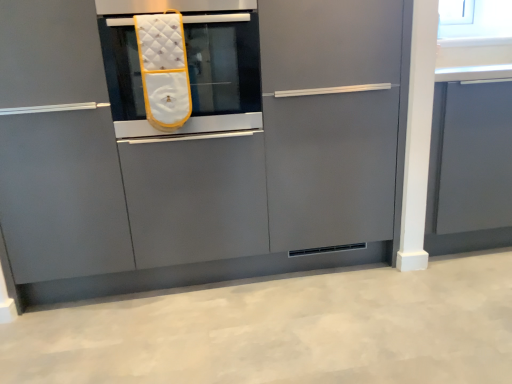
Describe the element at coordinates (195, 144) in the screenshot. I see `matte gray cabinet at center, the first cabinetry from the left` at that location.

What do you see at coordinates (223, 63) in the screenshot? I see `white quilted oven mitt at center` at bounding box center [223, 63].

Locate an element on the screen. The width and height of the screenshot is (512, 384). matte gray cabinet at center, which is the second cabinetry in right-to-left order is located at coordinates (195, 144).

From a real-world perspective, is matte gray cabinet at center, the first cabinetry from the left, positioned under matte gray cabinet at right, the 2th cabinetry positioned from the left, based on gravity?

Incorrect, from a real-world perspective, matte gray cabinet at center, the first cabinetry from the left, is higher than matte gray cabinet at right, the 2th cabinetry positioned from the left.

In the scene shown: In terms of width, does matte gray cabinet at center, which is the second cabinetry in right-to-left order, look wider or thinner when compared to matte gray cabinet at right, marked as the first cabinetry in a right-to-left arrangement?

Considering their sizes, matte gray cabinet at center, which is the second cabinetry in right-to-left order, looks broader than matte gray cabinet at right, marked as the first cabinetry in a right-to-left arrangement.

Is matte gray cabinet at center, which is the second cabinetry in right-to-left order, not close to matte gray cabinet at right, marked as the first cabinetry in a right-to-left arrangement?

matte gray cabinet at center, which is the second cabinetry in right-to-left order, is actually quite close to matte gray cabinet at right, marked as the first cabinetry in a right-to-left arrangement.

Who is smaller, white quilted oven mitt at center or matte gray cabinet at right, the 2th cabinetry positioned from the left?

Smaller between the two is white quilted oven mitt at center.

Consider the image. Are white quilted oven mitt at center and matte gray cabinet at right, the 2th cabinetry positioned from the left, making contact?

There is a gap between white quilted oven mitt at center and matte gray cabinet at right, the 2th cabinetry positioned from the left.

Looking at this image, based on their positions, is white quilted oven mitt at center located to the left or right of matte gray cabinet at right, marked as the first cabinetry in a right-to-left arrangement?

Clearly, white quilted oven mitt at center is on the left of matte gray cabinet at right, marked as the first cabinetry in a right-to-left arrangement, in the image.

This screenshot has width=512, height=384. What are the coordinates of `the 2nd cabinetry to the right of the white quilted oven mitt at center, starting your count from the anchor` in the screenshot? It's located at (470, 168).

How distant is white quilted oven mitt at center from matte gray cabinet at center, which is the second cabinetry in right-to-left order?

8.73 inches.

Is white quilted oven mitt at center directly adjacent to matte gray cabinet at center, the first cabinetry from the left?

No, white quilted oven mitt at center is not in contact with matte gray cabinet at center, the first cabinetry from the left.

Based on the photo, from the image's perspective, who appears lower, white quilted oven mitt at center or matte gray cabinet at center, which is the second cabinetry in right-to-left order?

From the image's view, matte gray cabinet at center, which is the second cabinetry in right-to-left order, is below.

Considering the positions of point (206, 46) and point (203, 235), is point (206, 46) closer or farther from the camera than point (203, 235)?

Clearly, point (206, 46) is closer to the camera than point (203, 235).

Considering the sizes of objects matte gray cabinet at right, marked as the first cabinetry in a right-to-left arrangement, and matte gray cabinet at center, which is the second cabinetry in right-to-left order, in the image provided, who is shorter, matte gray cabinet at right, marked as the first cabinetry in a right-to-left arrangement, or matte gray cabinet at center, which is the second cabinetry in right-to-left order,?

Standing shorter between the two is matte gray cabinet at right, marked as the first cabinetry in a right-to-left arrangement.

Measure the distance from matte gray cabinet at right, the 2th cabinetry positioned from the left, to matte gray cabinet at center, which is the second cabinetry in right-to-left order.

They are 74.49 centimeters apart.

Based on their sizes in the image, would you say matte gray cabinet at right, the 2th cabinetry positioned from the left, is bigger or smaller than matte gray cabinet at center, which is the second cabinetry in right-to-left order?

Considering their sizes, matte gray cabinet at right, the 2th cabinetry positioned from the left, takes up less space than matte gray cabinet at center, which is the second cabinetry in right-to-left order.

Is matte gray cabinet at center, which is the second cabinetry in right-to-left order, at the back of matte gray cabinet at right, the 2th cabinetry positioned from the left?

No, matte gray cabinet at center, which is the second cabinetry in right-to-left order, is not at the back of matte gray cabinet at right, the 2th cabinetry positioned from the left.

Is matte gray cabinet at right, marked as the first cabinetry in a right-to-left arrangement, positioned in front of white quilted oven mitt at center?

No, matte gray cabinet at right, marked as the first cabinetry in a right-to-left arrangement, is further to the viewer.

Looking at this image, from the image's perspective, which one is positioned higher, matte gray cabinet at right, the 2th cabinetry positioned from the left, or white quilted oven mitt at center?

From the image's view, white quilted oven mitt at center is above.

Looking at the image, does matte gray cabinet at right, the 2th cabinetry positioned from the left, seem bigger or smaller compared to white quilted oven mitt at center?

Considering their sizes, matte gray cabinet at right, the 2th cabinetry positioned from the left, takes up more space than white quilted oven mitt at center.

Which of these two, matte gray cabinet at right, the 2th cabinetry positioned from the left, or white quilted oven mitt at center, is thinner?

Thinner between the two is matte gray cabinet at right, the 2th cabinetry positioned from the left.

From the image's perspective, who appears lower, matte gray cabinet at center, the first cabinetry from the left, or white quilted oven mitt at center?

matte gray cabinet at center, the first cabinetry from the left.

Where is `oven above the matte gray cabinet at center, which is the second cabinetry in right-to-left order (from a real-world perspective)`? The height and width of the screenshot is (384, 512). oven above the matte gray cabinet at center, which is the second cabinetry in right-to-left order (from a real-world perspective) is located at coordinates (223, 63).

From a real-world perspective, is matte gray cabinet at center, the first cabinetry from the left, positioned over white quilted oven mitt at center based on gravity?

No, from a real-world perspective, matte gray cabinet at center, the first cabinetry from the left, is not over white quilted oven mitt at center

What are the coordinates of `cabinetry above the matte gray cabinet at right, marked as the first cabinetry in a right-to-left arrangement (from a real-world perspective)` in the screenshot? It's located at (195, 144).

I want to click on the 2nd cabinetry positioned below the white quilted oven mitt at center (from a real-world perspective), so click(470, 168).

Based on their spatial positions, is matte gray cabinet at right, the 2th cabinetry positioned from the left, or white quilted oven mitt at center closer to matte gray cabinet at center, the first cabinetry from the left?

white quilted oven mitt at center is closer to matte gray cabinet at center, the first cabinetry from the left.

Which object lies further to the anchor point matte gray cabinet at center, which is the second cabinetry in right-to-left order, white quilted oven mitt at center or matte gray cabinet at right, marked as the first cabinetry in a right-to-left arrangement?

matte gray cabinet at right, marked as the first cabinetry in a right-to-left arrangement.

Which object lies further to the anchor point matte gray cabinet at right, marked as the first cabinetry in a right-to-left arrangement, matte gray cabinet at center, the first cabinetry from the left, or white quilted oven mitt at center?

white quilted oven mitt at center.

From the image, which object appears to be farther from matte gray cabinet at right, marked as the first cabinetry in a right-to-left arrangement, white quilted oven mitt at center or matte gray cabinet at center, which is the second cabinetry in right-to-left order?

white quilted oven mitt at center.

From the image, which object appears to be nearer to white quilted oven mitt at center, matte gray cabinet at center, which is the second cabinetry in right-to-left order, or matte gray cabinet at right, the 2th cabinetry positioned from the left?

matte gray cabinet at center, which is the second cabinetry in right-to-left order, is positioned closer to the anchor white quilted oven mitt at center.

Considering their positions, is matte gray cabinet at right, marked as the first cabinetry in a right-to-left arrangement, positioned closer to white quilted oven mitt at center than matte gray cabinet at center, which is the second cabinetry in right-to-left order?

The object closer to white quilted oven mitt at center is matte gray cabinet at center, which is the second cabinetry in right-to-left order.

This screenshot has width=512, height=384. Identify the location of cabinetry between white quilted oven mitt at center and matte gray cabinet at right, marked as the first cabinetry in a right-to-left arrangement. (195, 144).